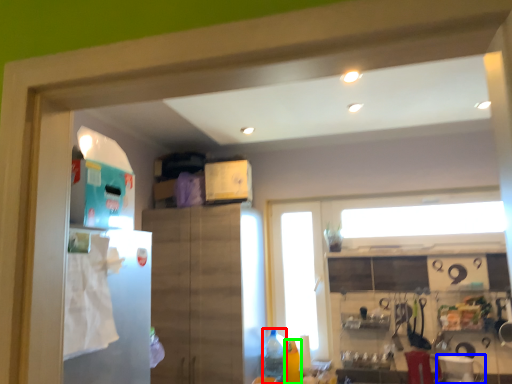
Question: Considering the real-world distances, which object is farthest from bottle (highlighted by a red box)? appliance (highlighted by a blue box) or bottle (highlighted by a green box)?

Choices:
 (A) appliance
 (B) bottle

Answer: (A)